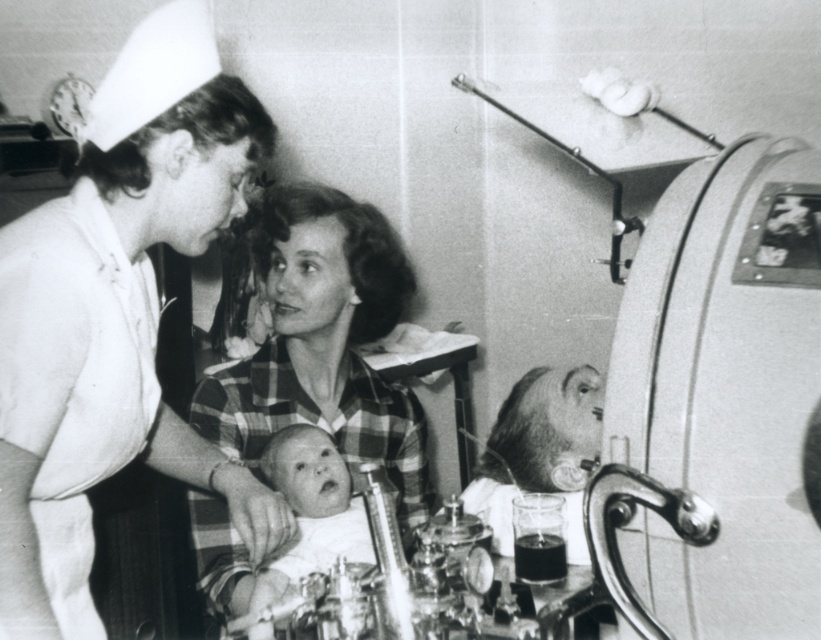
Is white uniform at center closer to the viewer compared to smooth white baby at center?

Yes.

What are the coordinates of `white uniform at center` in the screenshot? It's located at (117, 316).

Where is `white uniform at center`? The image size is (821, 640). white uniform at center is located at coordinates (117, 316).

Who is shorter, plaid fabric shirt at center or smooth white baby at center?

smooth white baby at center is shorter.

Which is above, plaid fabric shirt at center or smooth white baby at center?

plaid fabric shirt at center is higher up.

Who is more forward, (315, 417) or (251, 616)?

Point (251, 616)

You are a GUI agent. You are given a task and a screenshot of the screen. Output one action in this format:
    pyautogui.click(x=<x>, y=<y>)
    Task: Click on the plaid fabric shirt at center
    The width and height of the screenshot is (821, 640).
    Given the screenshot: What is the action you would take?
    pyautogui.click(x=323, y=340)

Does white uniform at center appear over plaid fabric shirt at center?

Yes.

Between point (223, 486) and point (264, 403), which one is positioned in front?

Positioned in front is point (223, 486).

Where is `white uniform at center`? The width and height of the screenshot is (821, 640). white uniform at center is located at coordinates (117, 316).